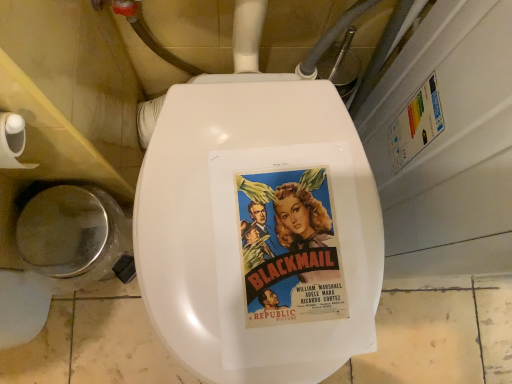
Measure the distance between vintage paper poster at center and camera.

A: A distance of 22.24 inches exists between vintage paper poster at center and camera.

Image resolution: width=512 pixels, height=384 pixels. I want to click on vintage paper poster at center, so click(289, 248).

Which object is further away from the camera taking this photo, white matte toilet paper at left or vintage paper poster at center?

Positioned behind is vintage paper poster at center.

Who is shorter, white matte toilet paper at left or vintage paper poster at center?

vintage paper poster at center is shorter.

Considering the points (13, 164) and (257, 215), which point is behind, point (13, 164) or point (257, 215)?

The point (257, 215) is behind.

Is white matte toilet paper at left facing away from shiny silver lid at lower left?

No, white matte toilet paper at left's orientation is not away from shiny silver lid at lower left.

Are white matte toilet paper at left and shiny silver lid at lower left far apart?

No, white matte toilet paper at left is not far from shiny silver lid at lower left.

Is white matte toilet paper at left wider than shiny silver lid at lower left?

In fact, white matte toilet paper at left might be narrower than shiny silver lid at lower left.

Is white matte toilet paper at left further to the viewer compared to shiny silver lid at lower left?

No, it is in front of shiny silver lid at lower left.

Locate an element on the screen. toilet bowl on the left of the white matte toilet paper at left is located at coordinates (75, 237).

Based on their sizes in the image, would you say shiny silver lid at lower left is bigger or smaller than white matte toilet paper at left?

shiny silver lid at lower left is bigger than white matte toilet paper at left.

Is shiny silver lid at lower left positioned with its back to white matte toilet paper at left?

That's not correct — shiny silver lid at lower left is not looking away from white matte toilet paper at left.

Is shiny silver lid at lower left taller or shorter than white matte toilet paper at left?

In the image, shiny silver lid at lower left appears to be taller than white matte toilet paper at left.

Is the surface of vintage paper poster at center in direct contact with shiny silver lid at lower left?

There is a gap between vintage paper poster at center and shiny silver lid at lower left.

Is vintage paper poster at center to the left of shiny silver lid at lower left from the viewer's perspective?

No.

Does point (287, 193) come farther from viewer compared to point (37, 232)?

No, it is in front of (37, 232).

From a real-world perspective, is vintage paper poster at center positioned above or below shiny silver lid at lower left?

In terms of real-world spatial position, vintage paper poster at center is above shiny silver lid at lower left.

Visually, is shiny silver lid at lower left positioned to the left or to the right of vintage paper poster at center?

From the image, it's evident that shiny silver lid at lower left is to the left of vintage paper poster at center.

Between shiny silver lid at lower left and vintage paper poster at center, which one has smaller width?

Thinner between the two is shiny silver lid at lower left.

Based on the photo, is shiny silver lid at lower left in front of or behind vintage paper poster at center in the image?

shiny silver lid at lower left is positioned farther from the viewer than vintage paper poster at center.

Considering the relative sizes of vintage paper poster at center and white matte toilet paper at left in the image provided, is vintage paper poster at center taller than white matte toilet paper at left?

In fact, vintage paper poster at center may be shorter than white matte toilet paper at left.

Does vintage paper poster at center turn towards white matte toilet paper at left?

No, vintage paper poster at center is not oriented towards white matte toilet paper at left.

Which object is more forward, vintage paper poster at center or white matte toilet paper at left?

Positioned in front is white matte toilet paper at left.

The width and height of the screenshot is (512, 384). I want to click on toilet paper lying on the left of vintage paper poster at center, so click(12, 141).

I want to click on toilet paper in front of the shiny silver lid at lower left, so (x=12, y=141).

Based on their spatial positions, is white matte toilet paper at left or shiny silver lid at lower left further from vintage paper poster at center?

Based on the image, shiny silver lid at lower left appears to be further to vintage paper poster at center.

Looking at the image, which one is located closer to vintage paper poster at center, shiny silver lid at lower left or white matte toilet paper at left?

white matte toilet paper at left is positioned closer to the anchor vintage paper poster at center.

Considering their positions, is vintage paper poster at center positioned closer to white matte toilet paper at left than shiny silver lid at lower left?

shiny silver lid at lower left.

Estimate the real-world distances between objects in this image. Which object is further from shiny silver lid at lower left, vintage paper poster at center or white matte toilet paper at left?

vintage paper poster at center is further to shiny silver lid at lower left.

Looking at the image, which one is located closer to shiny silver lid at lower left, white matte toilet paper at left or vintage paper poster at center?

white matte toilet paper at left is positioned closer to the anchor shiny silver lid at lower left.

Which object lies nearer to the anchor point white matte toilet paper at left, shiny silver lid at lower left or vintage paper poster at center?

Among the two, shiny silver lid at lower left is located nearer to white matte toilet paper at left.

This screenshot has width=512, height=384. Identify the location of toilet paper situated between shiny silver lid at lower left and vintage paper poster at center from left to right. (12, 141).